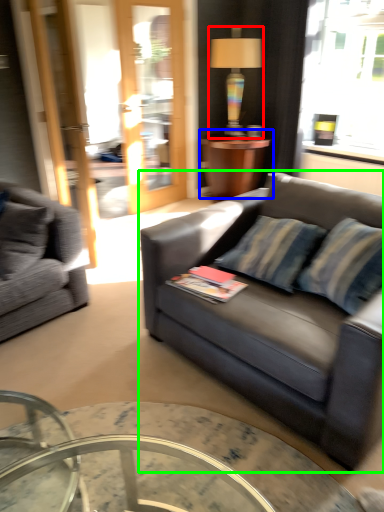
Question: Based on their relative distances, which object is nearer to lamp (highlighted by a red box)? Choose from table (highlighted by a blue box) and studio couch (highlighted by a green box).

Choices:
 (A) table
 (B) studio couch

Answer: (A)